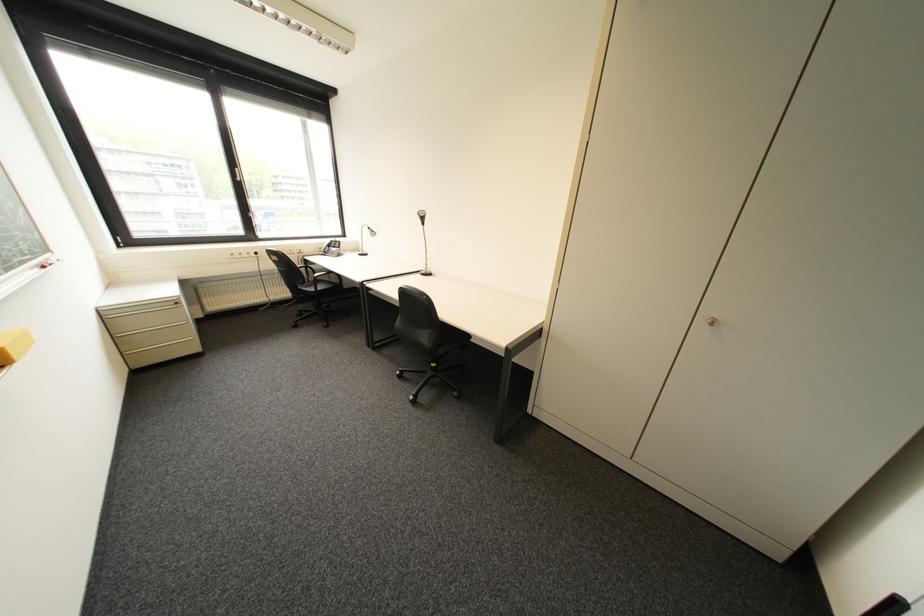
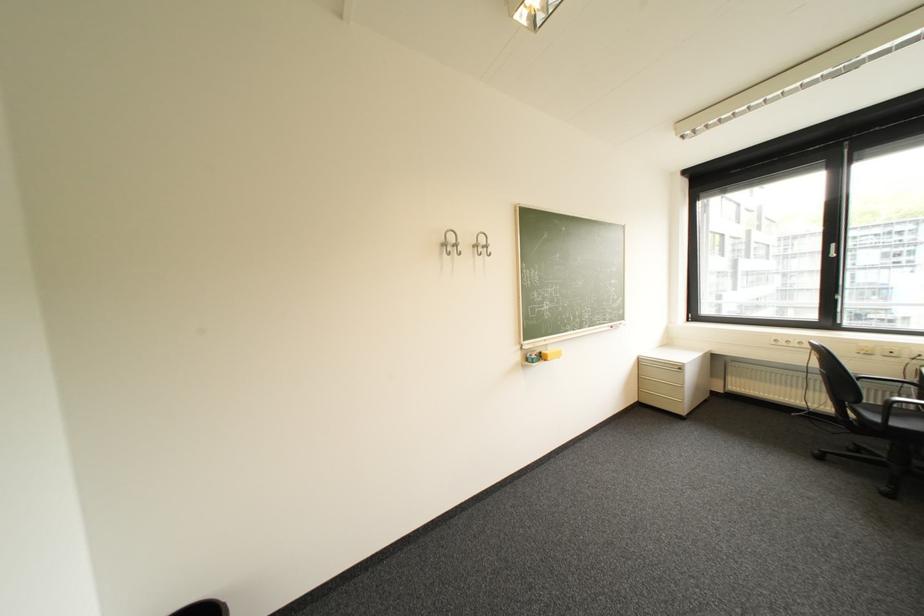
Question: The images are taken continuously from a first-person perspective. In which direction is your viewpoint rotating?

Choices:
 (A) Left
 (B) Right
 (C) Up
 (D) Down

Answer: (A)